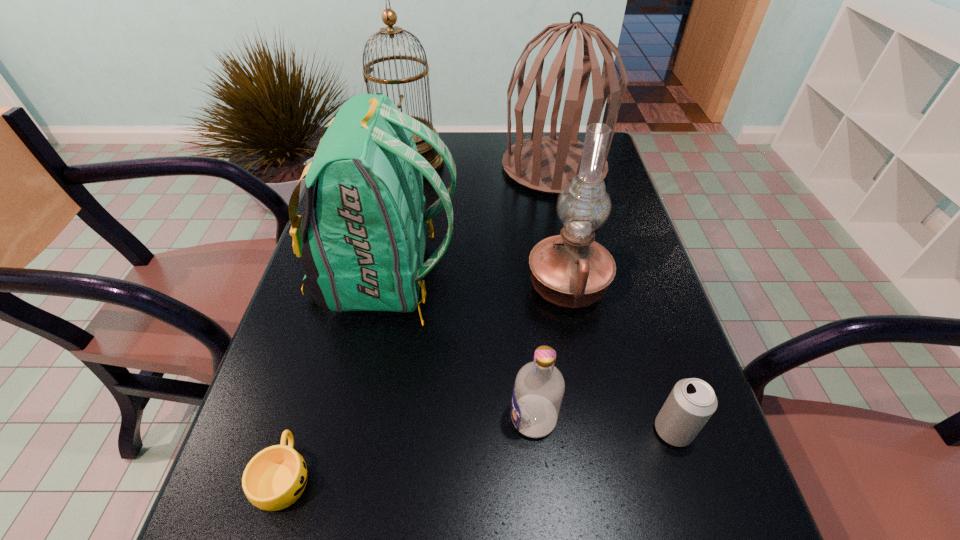
Where is `vacant position in the image that satisfies the following two spatial constraints: 1. on the back side of the oil lamp; 2. on the left side of the cup`? Image resolution: width=960 pixels, height=540 pixels. vacant position in the image that satisfies the following two spatial constraints: 1. on the back side of the oil lamp; 2. on the left side of the cup is located at coordinates (342, 286).

At what (x,y) coordinates should I click in order to perform the action: click on vacant space that satisfies the following two spatial constraints: 1. with an open door on the left birdcage; 2. on the back side of the sixth tallest object. Please return your answer as a coordinate pair (x, y). Looking at the image, I should click on (352, 430).

Find the location of a particular element. The height and width of the screenshot is (540, 960). vacant area in the image that satisfies the following two spatial constraints: 1. on the back side of the oil lamp; 2. on the back of the backpack is located at coordinates pyautogui.click(x=566, y=277).